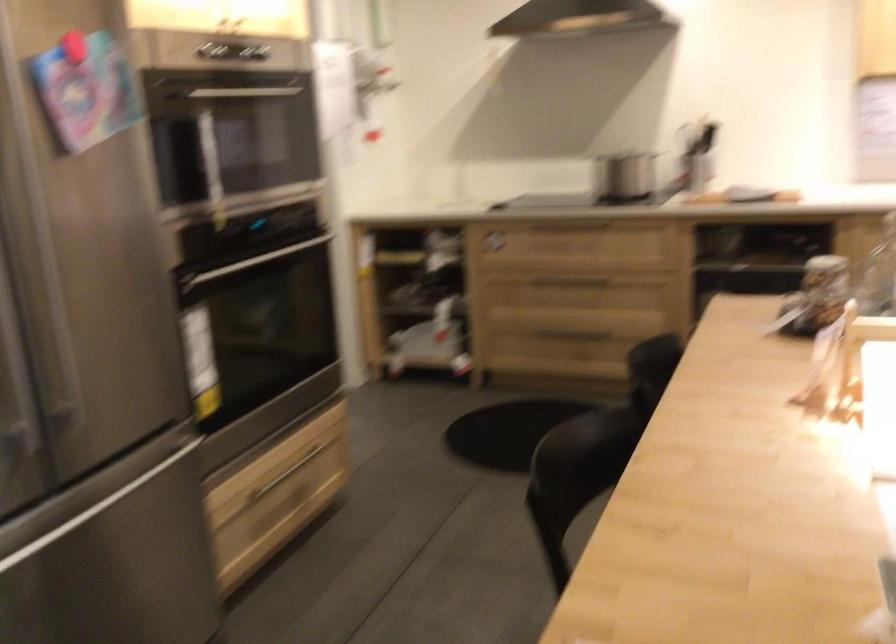
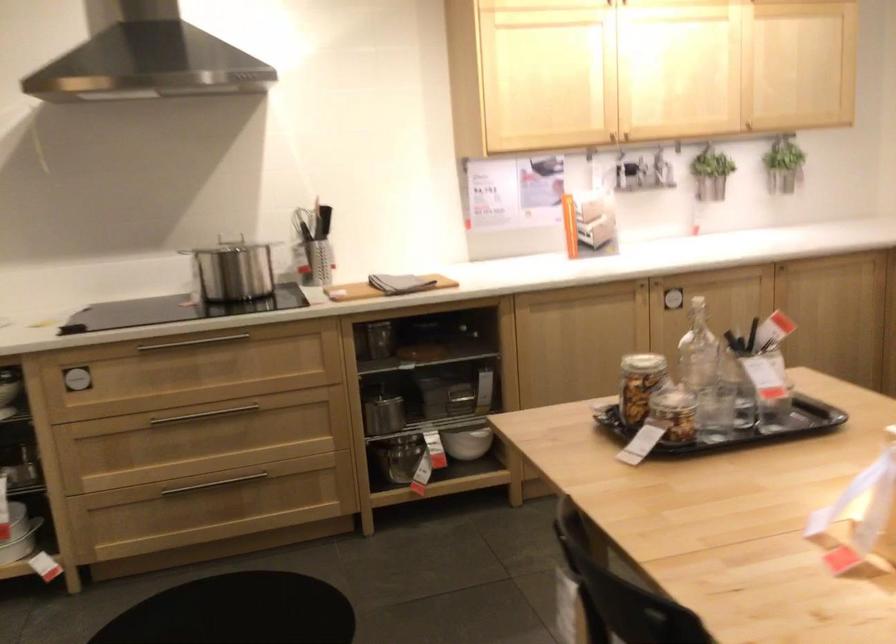
Find the pixel in the second image that matches point 615,167 in the first image.

(231, 274)